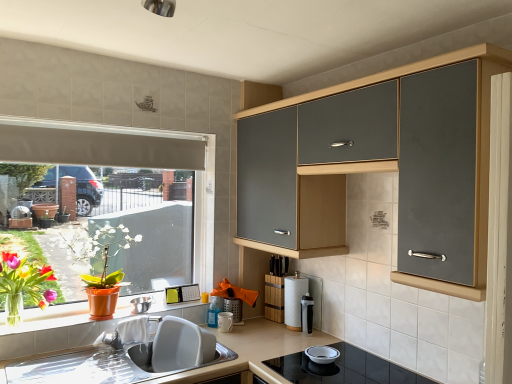
Find the location of a particular element. The image size is (512, 384). free space in front of black plastic water bottle at upper right, which is the 6th appliance in left-to-right order is located at coordinates (304, 345).